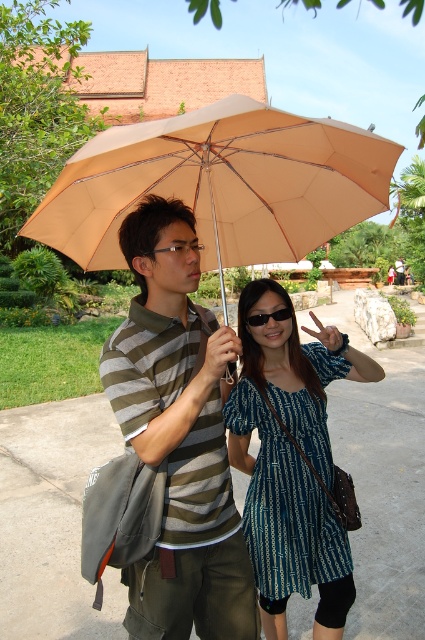
Question: Which point is farther from the camera taking this photo?

Choices:
 (A) (181, 465)
 (B) (274, 317)

Answer: (B)

Question: Is striped cotton shirt at center below black plastic goggles at center?

Choices:
 (A) yes
 (B) no

Answer: (A)

Question: Can you confirm if striped cotton shirt at center is bigger than black plastic goggles at center?

Choices:
 (A) yes
 (B) no

Answer: (A)

Question: Which of these objects is positioned farthest from the blue printed dress at center?

Choices:
 (A) black plastic goggles at center
 (B) beige fabric umbrella at upper center
 (C) striped cotton shirt at center

Answer: (B)

Question: Which of these objects is positioned closest to the striped cotton shirt at center?

Choices:
 (A) blue printed dress at center
 (B) beige fabric umbrella at upper center
 (C) black plastic goggles at center

Answer: (A)

Question: Is blue printed dress at center closer to camera compared to black plastic goggles at center?

Choices:
 (A) yes
 (B) no

Answer: (A)